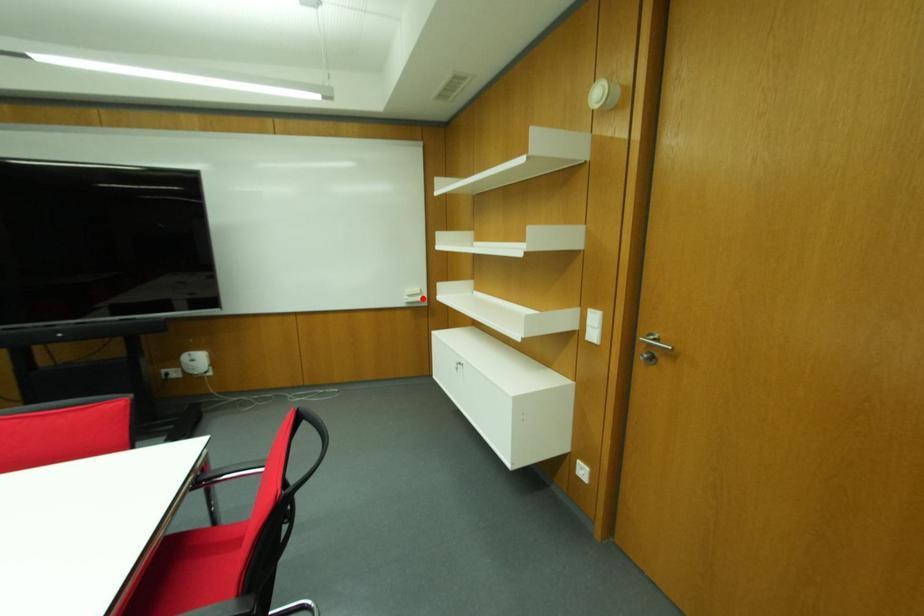
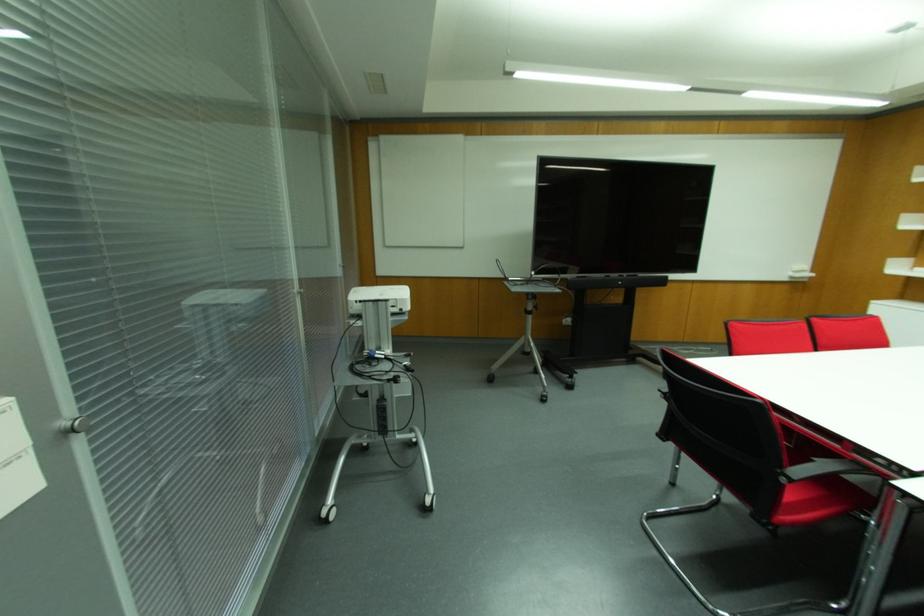
Question: I am providing you with two images of the same scene from different viewpoints. A red point is marked on the first image. At the location where the point appears in image 1, is it still visible in image 2?

Choices:
 (A) Yes
 (B) No

Answer: (A)